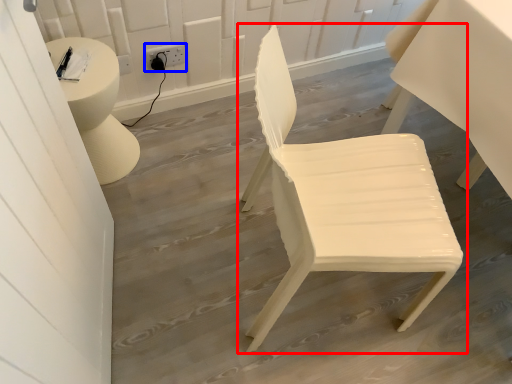
Question: Which object appears closest to the camera in this image, chair (highlighted by a red box) or electric outlet (highlighted by a blue box)?

Choices:
 (A) chair
 (B) electric outlet

Answer: (A)